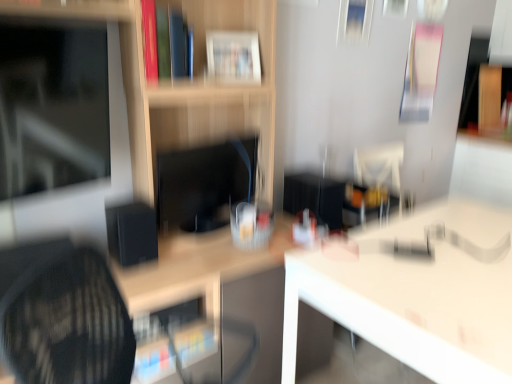
Question: Is white glossy book at upper center, the 1th book in the right-to-left sequence, situated inside black matte speaker at center-left or outside?

Choices:
 (A) inside
 (B) outside

Answer: (B)

Question: Considering the positions of point [x=258, y=66] and point [x=117, y=205], is point [x=258, y=66] closer or farther from the camera than point [x=117, y=205]?

Choices:
 (A) closer
 (B) farther

Answer: (B)

Question: Which object is the farthest from the black matte speaker at center-left?

Choices:
 (A) white glossy book at upper center, marked as the 2th book in a left-to-right arrangement
 (B) matte black monitor at left, arranged as the 1th computer monitor when viewed from the left
 (C) hardcover book at upper center, the first book in the left-to-right sequence
 (D) wooden shelf at center
 (E) matte black monitor at center, the 1th computer monitor when ordered from right to left

Answer: (A)

Question: Which object is positioned closest to the wooden shelf at center?

Choices:
 (A) white glossy book at upper center, placed as the second book when sorted from front to back
 (B) matte black monitor at center, the 1th computer monitor when ordered from right to left
 (C) hardcover book at upper center, positioned as the second book in right-to-left order
 (D) white glossy table at center, the first table from the right
 (E) matte black monitor at left, which is the 2th computer monitor from back to front

Answer: (B)